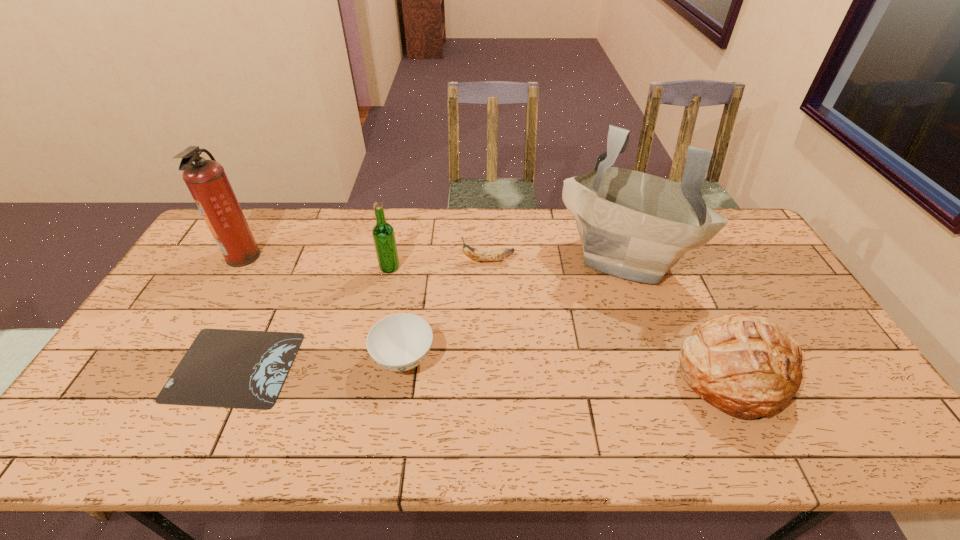
Image resolution: width=960 pixels, height=540 pixels. What are the coordinates of `vacant area that lies between the fifth object from left to right and the chinaware` in the screenshot? It's located at (445, 309).

In order to click on free space between the shopping bag and the mousepad in this screenshot , I will do pyautogui.click(x=430, y=311).

You are a GUI agent. You are given a task and a screenshot of the screen. Output one action in this format:
    pyautogui.click(x=<x>, y=<y>)
    Task: Click on the vacant region between the banana and the shortest object
    
    Given the screenshot: What is the action you would take?
    pyautogui.click(x=361, y=313)

At what (x,y) coordinates should I click in order to perform the action: click on free space between the bread and the third object from right to left. Please return your answer as a coordinate pair (x, y). The width and height of the screenshot is (960, 540). Looking at the image, I should click on (612, 318).

Locate an element on the screen. The height and width of the screenshot is (540, 960). vacant point located between the fourth tallest object and the chinaware is located at coordinates (570, 367).

The height and width of the screenshot is (540, 960). What are the coordinates of `free spot between the shopping bag and the third object from right to left` in the screenshot? It's located at (557, 258).

Find the location of `vacant area that lies between the shopping bag and the third tallest object`. vacant area that lies between the shopping bag and the third tallest object is located at coordinates (508, 261).

At what (x,y) coordinates should I click in order to perform the action: click on free space between the mousepad and the third object from right to left. Please return your answer as a coordinate pair (x, y). Image resolution: width=960 pixels, height=540 pixels. Looking at the image, I should click on (361, 313).

The width and height of the screenshot is (960, 540). What are the coordinates of `vacant region between the beer bottle and the shopping bag` in the screenshot? It's located at (508, 261).

At what (x,y) coordinates should I click in order to perform the action: click on the third closest object to the third tallest object. Please return your answer as a coordinate pair (x, y). Looking at the image, I should click on (244, 369).